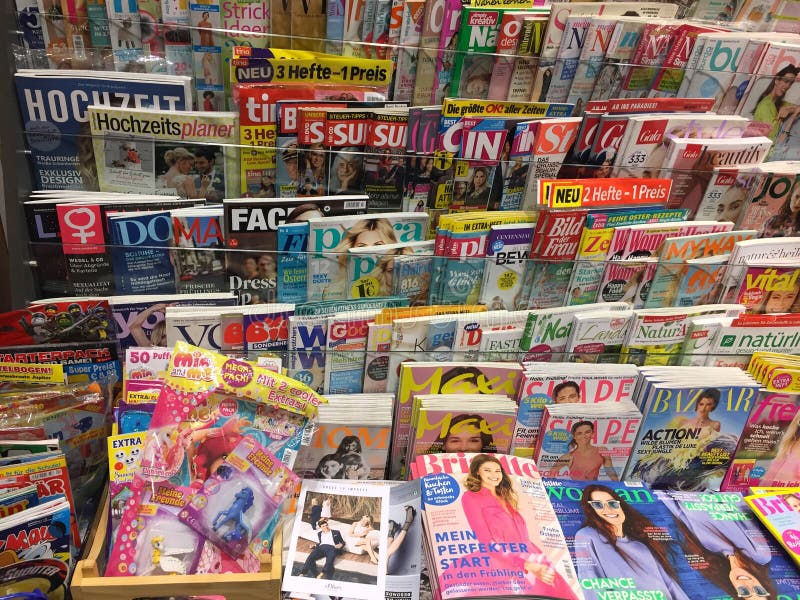
Locate an element on the screen. This screenshot has width=800, height=600. front rack of magazines is located at coordinates (572, 419).